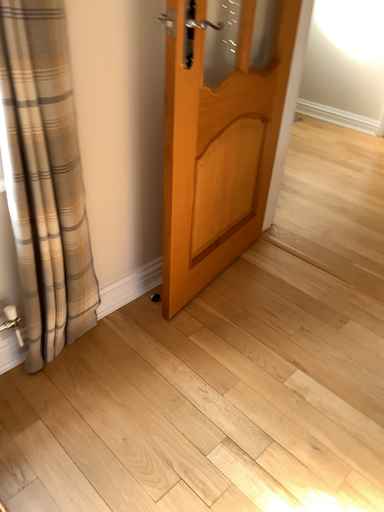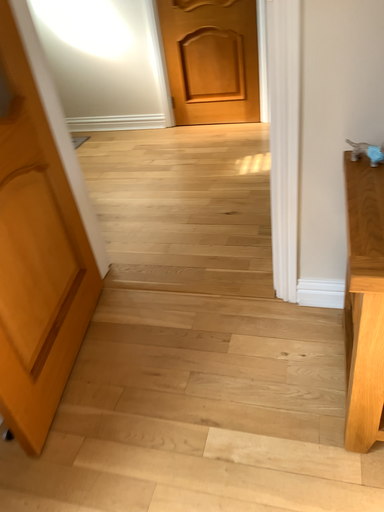
Question: Which way did the camera rotate in the video?

Choices:
 (A) rotated left
 (B) rotated right

Answer: (B)